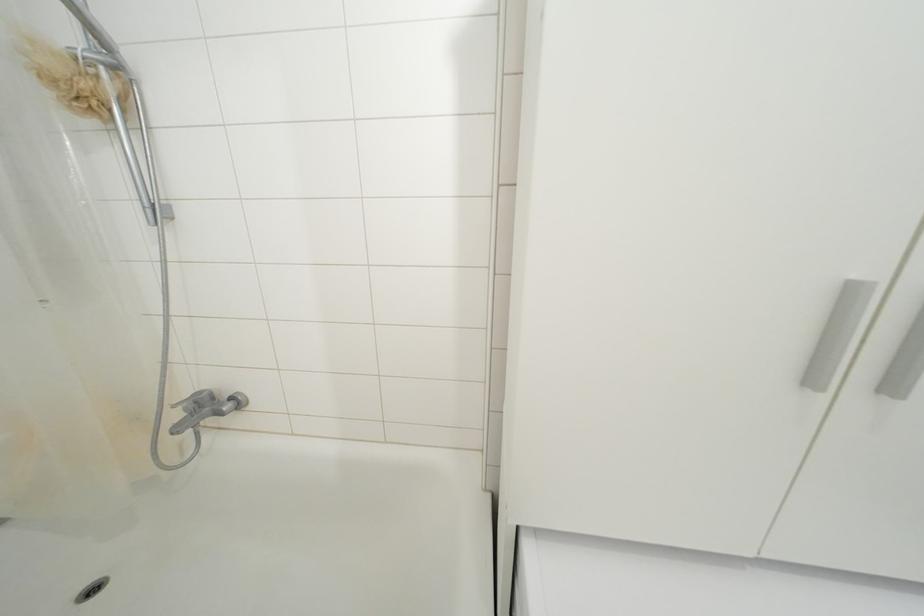
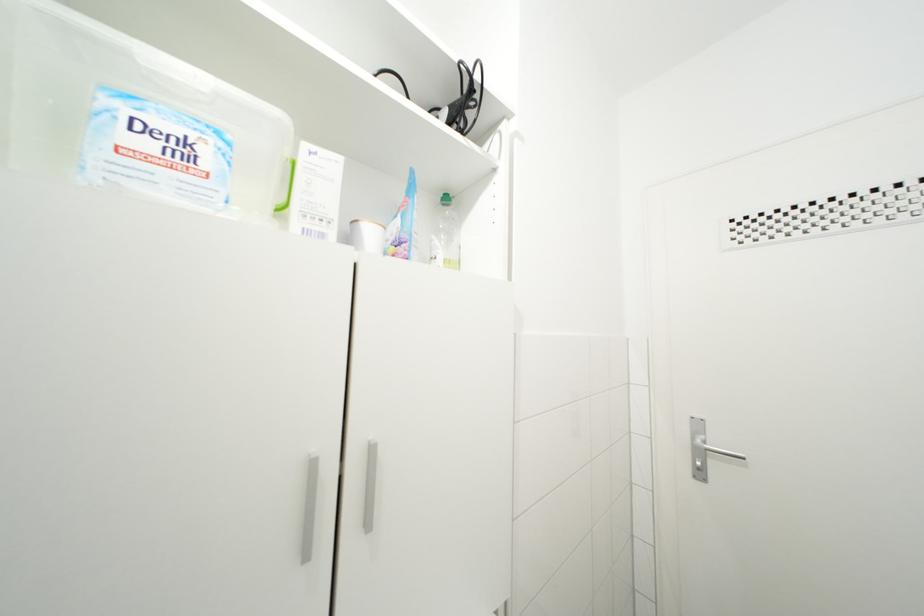
First-person continuous shooting, in which direction is the camera rotating?

The camera rotated toward right-up.